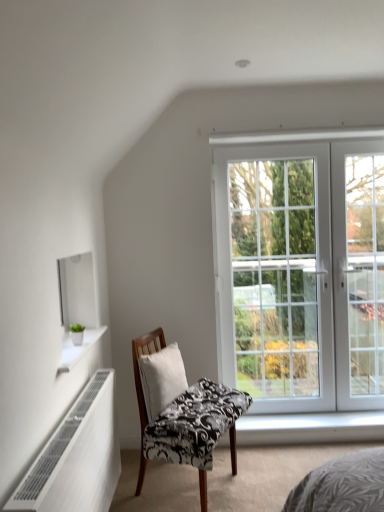
Question: Are black and white patterned chair at center and white glass door at right located far from each other?

Choices:
 (A) no
 (B) yes

Answer: (B)

Question: From a real-world perspective, is black and white patterned chair at center positioned over white glass door at right based on gravity?

Choices:
 (A) no
 (B) yes

Answer: (A)

Question: Does black and white patterned chair at center have a greater height compared to white glass door at right?

Choices:
 (A) yes
 (B) no

Answer: (B)

Question: From the image's perspective, is black and white patterned chair at center located beneath white glass door at right?

Choices:
 (A) yes
 (B) no

Answer: (A)

Question: Is black and white patterned chair at center touching white glass door at right?

Choices:
 (A) yes
 (B) no

Answer: (B)

Question: From the image's perspective, is white fabric pillow at center above or below white glass door at right?

Choices:
 (A) above
 (B) below

Answer: (B)

Question: Considering the positions of white fabric pillow at center and white glass door at right in the image, is white fabric pillow at center taller or shorter than white glass door at right?

Choices:
 (A) short
 (B) tall

Answer: (A)

Question: Is point (178, 375) closer or farther from the camera than point (342, 180)?

Choices:
 (A) farther
 (B) closer

Answer: (B)

Question: In the image, is white fabric pillow at center on the left side or the right side of white glass door at right?

Choices:
 (A) right
 (B) left

Answer: (B)

Question: Relative to white metallic radiator at lower left, is white fabric pillow at center in front or behind?

Choices:
 (A) behind
 (B) front

Answer: (A)

Question: Considering the positions of white fabric pillow at center and white metallic radiator at lower left in the image, is white fabric pillow at center wider or thinner than white metallic radiator at lower left?

Choices:
 (A) thin
 (B) wide

Answer: (A)

Question: In the image, is white fabric pillow at center on the left side or the right side of white metallic radiator at lower left?

Choices:
 (A) right
 (B) left

Answer: (A)

Question: Considering the positions of point (157, 381) and point (105, 411), is point (157, 381) closer or farther from the camera than point (105, 411)?

Choices:
 (A) closer
 (B) farther

Answer: (B)

Question: Considering the relative positions of white glass door at right and white metallic radiator at lower left in the image provided, is white glass door at right to the left or to the right of white metallic radiator at lower left?

Choices:
 (A) right
 (B) left

Answer: (A)

Question: Considering their positions, is white glass door at right located in front of or behind white metallic radiator at lower left?

Choices:
 (A) behind
 (B) front

Answer: (A)